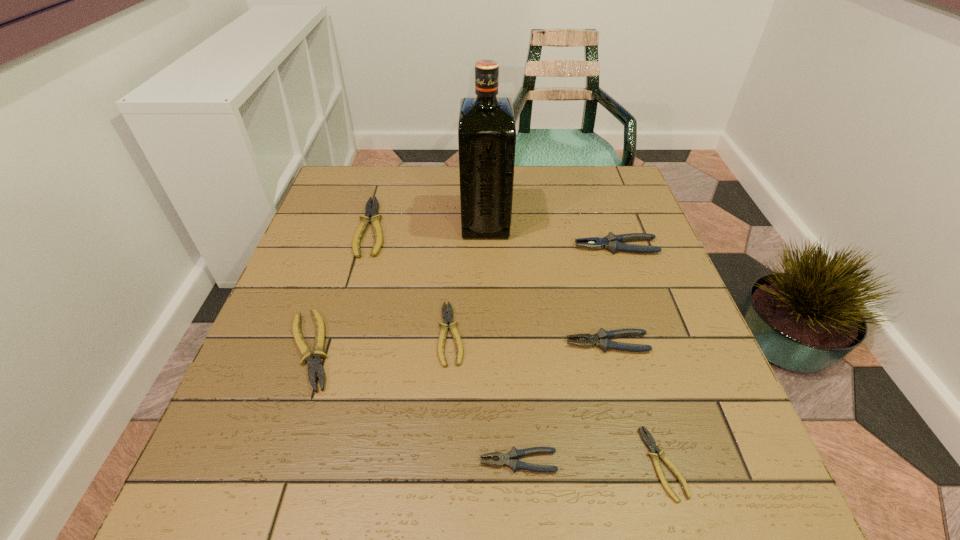
The image size is (960, 540). What are the coordinates of `pliers that is the third closest to the seventh shortest object` in the screenshot? It's located at (650, 443).

Identify which gray pliers is located as the nearest to the shortest pliers. Please provide its 2D coordinates. Your answer should be formatted as a tuple, i.e. [(x, y)], where the tuple contains the x and y coordinates of a point satisfying the conditions above.

[(513, 454)]

Identify which gray pliers is the third closest to the second biggest yellow pliers. Please provide its 2D coordinates. Your answer should be formatted as a tuple, i.e. [(x, y)], where the tuple contains the x and y coordinates of a point satisfying the conditions above.

[(612, 242)]

Identify which yellow pliers is the fourth nearest to the fourth pliers from left to right. Please provide its 2D coordinates. Your answer should be formatted as a tuple, i.e. [(x, y)], where the tuple contains the x and y coordinates of a point satisfying the conditions above.

[(371, 212)]

Image resolution: width=960 pixels, height=540 pixels. What are the coordinates of `yellow pliers that is the second closest one to the tallest object` in the screenshot? It's located at (447, 317).

The height and width of the screenshot is (540, 960). I want to click on blank space that satisfies the following two spatial constraints: 1. at the gripping part of the second farthest gray pliers; 2. on the right side of the shortest pliers, so click(638, 463).